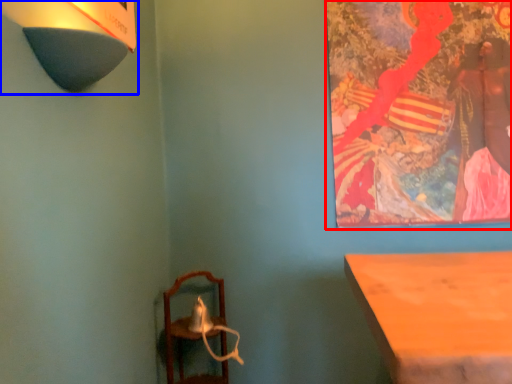
Question: Which object appears closest to the camera in this image, picture frame (highlighted by a red box) or lamp (highlighted by a blue box)?

Choices:
 (A) picture frame
 (B) lamp

Answer: (B)